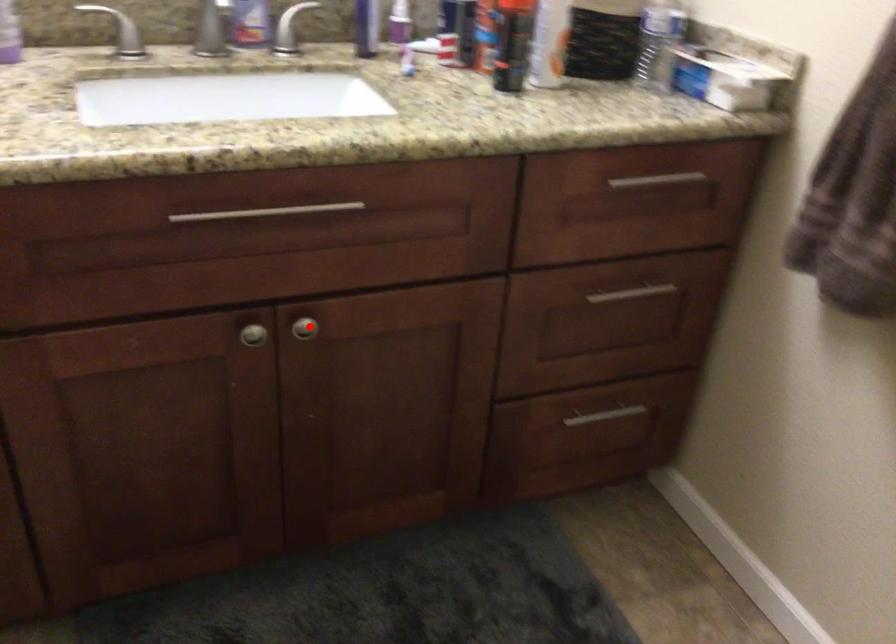
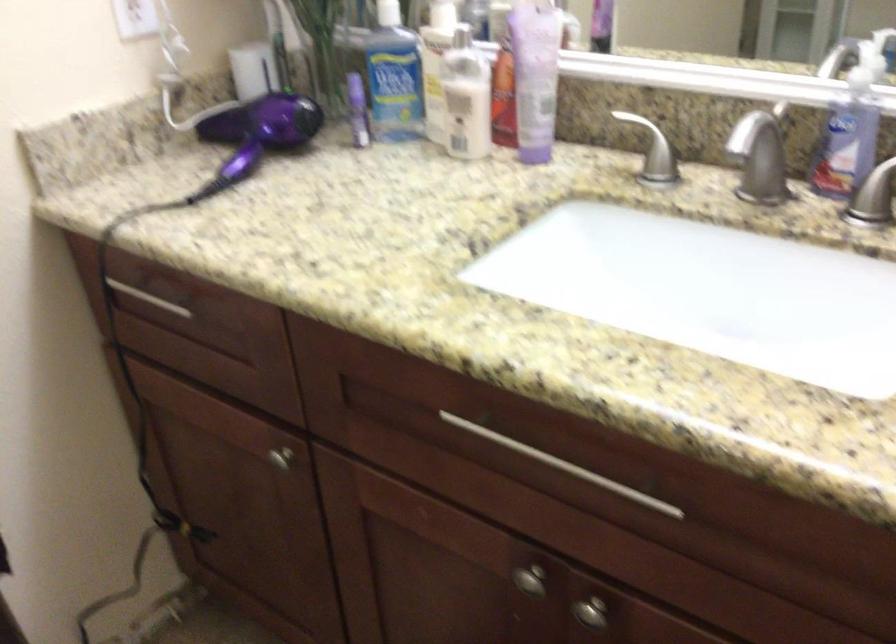
The point at the highlighted location is marked in the first image. Where is the corresponding point in the second image?

(590, 612)